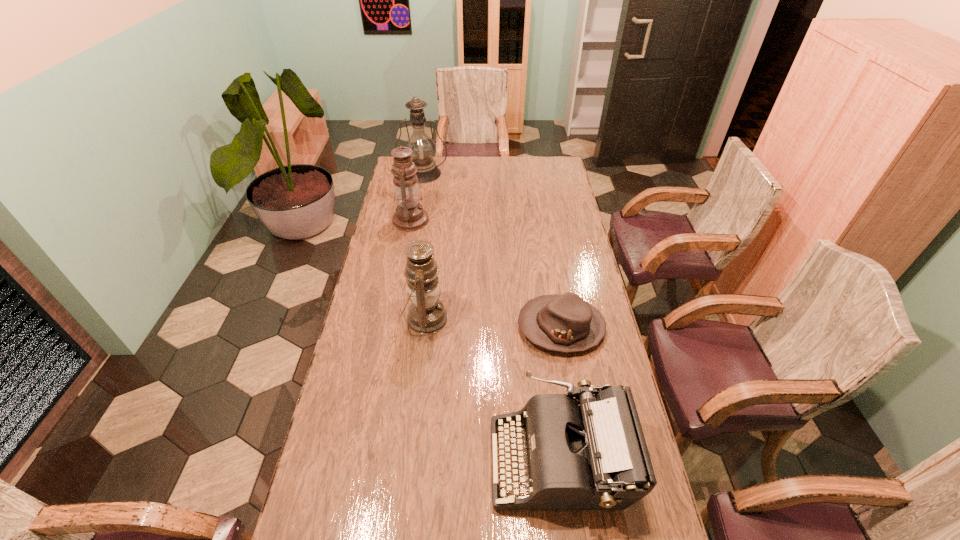
Where is `free point at the right edge`? The image size is (960, 540). free point at the right edge is located at coordinates (628, 532).

Identify the location of vacant area at the far right corner of the desktop. Image resolution: width=960 pixels, height=540 pixels. (557, 157).

Image resolution: width=960 pixels, height=540 pixels. I want to click on free space between the second farthest oil lamp and the shortest object, so click(x=486, y=274).

The width and height of the screenshot is (960, 540). I want to click on vacant space that is in between the nearest object and the second farthest oil lamp, so click(485, 340).

Identify the location of free area in between the second farthest object and the nearest object. (485, 340).

Find the location of `vacant space that is in between the second shortest object and the farthest object`. vacant space that is in between the second shortest object and the farthest object is located at coordinates (492, 316).

I want to click on free spot between the second farthest oil lamp and the hat, so pyautogui.click(x=486, y=274).

The image size is (960, 540). I want to click on vacant point located between the hat and the typewriter, so click(x=561, y=394).

This screenshot has width=960, height=540. I want to click on vacant space that's between the nearest object and the hat, so click(561, 394).

Where is `free space between the hat and the fourth nearest object`? The width and height of the screenshot is (960, 540). free space between the hat and the fourth nearest object is located at coordinates (486, 274).